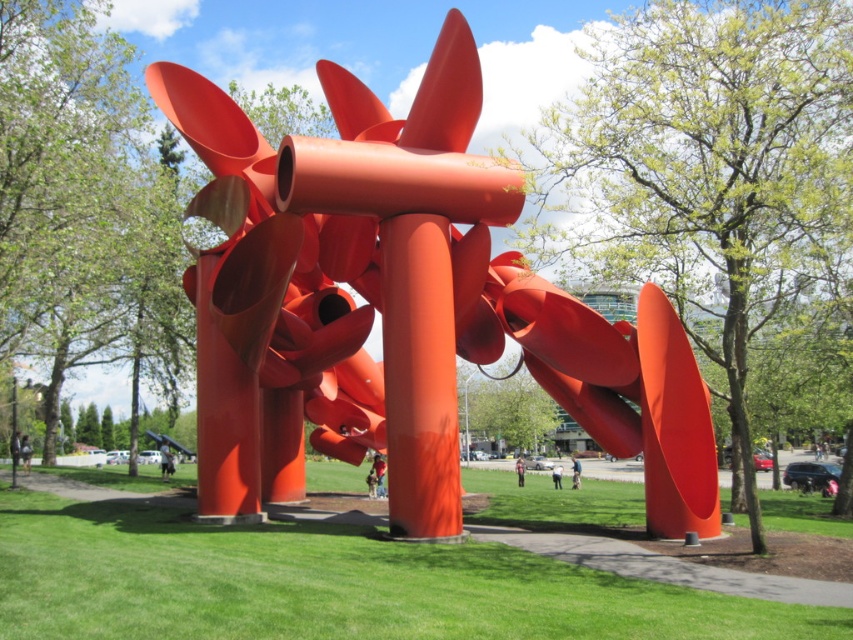
You are standing at the center of the grassy area and want to take a photo of the glossy metal sculpture at center. If you move 0.5 meters to the north, will you still be able to see the entire sculpture in your view? Please explain using the coordinates provided.

The glossy metal sculpture at center is positioned at coordinates approximately [403,304]. Moving 0.5 meters north from the center might place you slightly off the central axis. However, since the sculpture is centrally located and the scene includes surrounding trees and a modern building in the background, moving half a meter north is unlikely to block your view entirely. You should still see the entire sculpture unless there are unseen obstacles. The coordinates suggest the sculpture is near the exact

Looking at this image, you are a landscape architect designing a garden around the glossy metal sculpture at center. Considering the green grass at center, which object is taller and needs to be considered for visibility in the garden layout?

The glossy metal sculpture at center is taller than the green grass at center, so it should be the focal point and considered for visibility in the garden layout.